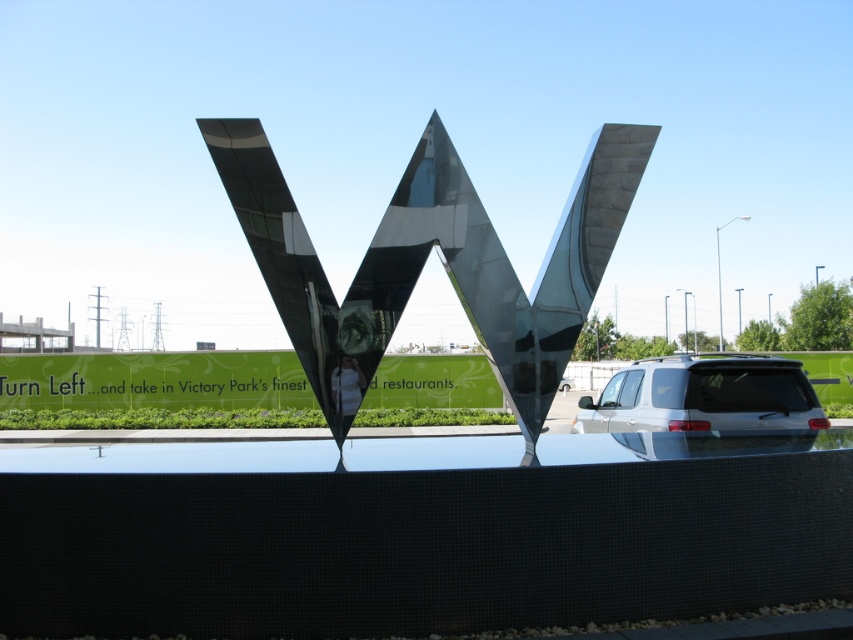
Does point (637, 428) lie behind point (22, 392)?

No, it is not.

Is silver metallic suv at lower right thinner than black metallic letter w at center?

In fact, silver metallic suv at lower right might be wider than black metallic letter w at center.

Locate an element on the screen. The width and height of the screenshot is (853, 640). silver metallic suv at lower right is located at coordinates (703, 396).

Which of these two, metallic reflective letter w at center or metallic silver letter w at center, stands shorter?

Standing shorter between the two is metallic silver letter w at center.

Is point (503, 273) farther from camera compared to point (7, 384)?

No, it is in front of (7, 384).

Is point (315, 300) in front of point (3, 392)?

Yes, point (315, 300) is in front of point (3, 392).

Where is `metallic reflective letter w at center`? The image size is (853, 640). metallic reflective letter w at center is located at coordinates (424, 260).

Is green matte sign at center thinner than brown matte letter at center?

No.

I want to click on green matte sign at center, so click(158, 380).

The height and width of the screenshot is (640, 853). In order to click on green matte sign at center in this screenshot , I will do `click(158, 380)`.